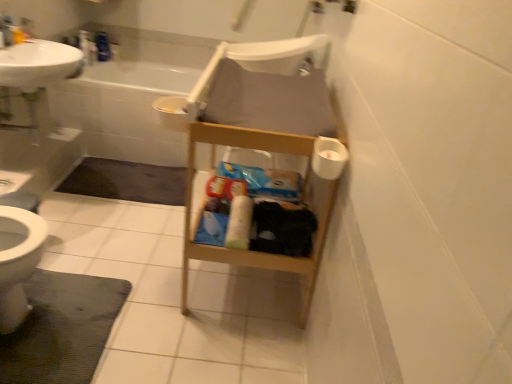
Question: Is white plastic chair at center oriented away from dark gray textured bath mat at lower left, acting as the second bath mat starting from the top?

Choices:
 (A) yes
 (B) no

Answer: (B)

Question: Can you confirm if white plastic chair at center is bigger than dark gray textured bath mat at lower left, the 1th bath mat when ordered from front to back?

Choices:
 (A) yes
 (B) no

Answer: (A)

Question: Considering the relative sizes of white plastic chair at center and dark gray textured bath mat at lower left, the 2th bath mat in the back-to-front sequence, in the image provided, is white plastic chair at center taller than dark gray textured bath mat at lower left, the 2th bath mat in the back-to-front sequence,?

Choices:
 (A) yes
 (B) no

Answer: (A)

Question: Is white plastic chair at center far from dark gray textured bath mat at lower left, the 1th bath mat when ordered from front to back?

Choices:
 (A) yes
 (B) no

Answer: (A)

Question: From a real-world perspective, is white plastic chair at center on dark gray textured bath mat at lower left, the 2th bath mat in the back-to-front sequence?

Choices:
 (A) yes
 (B) no

Answer: (A)

Question: Considering the positions of dark gray carpet at lower left, which is the 1th bath mat in back-to-front order, and white glossy sink at upper left in the image, is dark gray carpet at lower left, which is the 1th bath mat in back-to-front order, taller or shorter than white glossy sink at upper left?

Choices:
 (A) tall
 (B) short

Answer: (B)

Question: Would you say dark gray carpet at lower left, placed as the 2th bath mat when sorted from front to back, is to the left or to the right of white glossy sink at upper left in the picture?

Choices:
 (A) right
 (B) left

Answer: (A)

Question: Is point (156, 185) closer or farther from the camera than point (5, 69)?

Choices:
 (A) closer
 (B) farther

Answer: (B)

Question: Is dark gray carpet at lower left, the 2th bath mat positioned from the bottom, bigger or smaller than white glossy sink at upper left?

Choices:
 (A) small
 (B) big

Answer: (A)

Question: Considering the positions of white matte toilet paper at right, positioned as the 2th toilet paper in left-to-right order, and white glossy sink at upper left in the image, is white matte toilet paper at right, positioned as the 2th toilet paper in left-to-right order, wider or thinner than white glossy sink at upper left?

Choices:
 (A) wide
 (B) thin

Answer: (B)

Question: Would you say white matte toilet paper at right, which ranks as the second toilet paper in back-to-front order, is to the left or to the right of white glossy sink at upper left in the picture?

Choices:
 (A) right
 (B) left

Answer: (A)

Question: From their relative heights in the image, would you say white matte toilet paper at right, which ranks as the second toilet paper in back-to-front order, is taller or shorter than white glossy sink at upper left?

Choices:
 (A) short
 (B) tall

Answer: (A)

Question: Considering the positions of white matte toilet paper at right, the 1th toilet paper when ordered from front to back, and white glossy sink at upper left in the image, is white matte toilet paper at right, the 1th toilet paper when ordered from front to back, bigger or smaller than white glossy sink at upper left?

Choices:
 (A) big
 (B) small

Answer: (B)

Question: Considering the positions of white plastic chair at center and dark gray textured bath mat at lower left, which is the 1th bath mat from bottom to top, in the image, is white plastic chair at center bigger or smaller than dark gray textured bath mat at lower left, which is the 1th bath mat from bottom to top,?

Choices:
 (A) small
 (B) big

Answer: (B)

Question: Is white plastic chair at center situated inside dark gray textured bath mat at lower left, the 2th bath mat in the back-to-front sequence, or outside?

Choices:
 (A) outside
 (B) inside

Answer: (A)